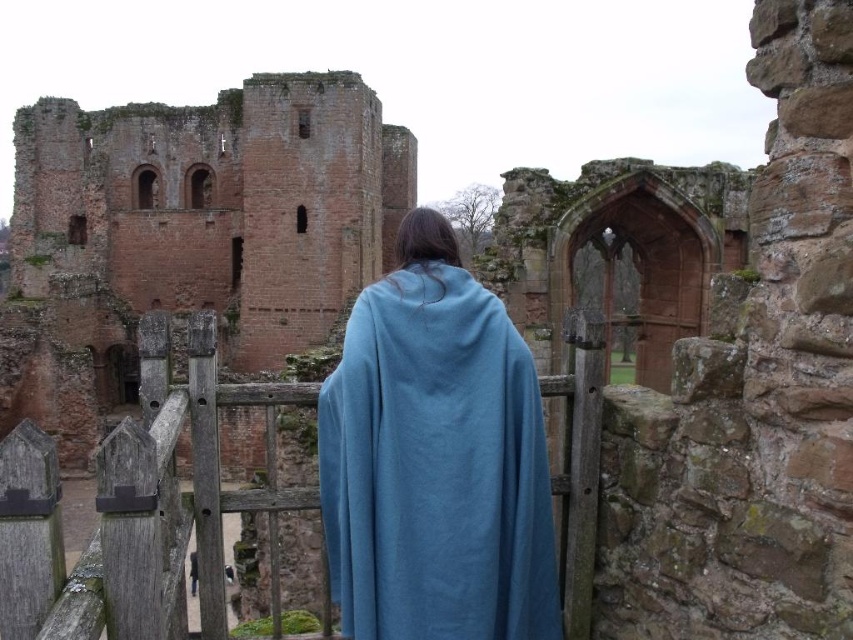
You are standing at a certain distance from the blue woolen cloak at center. If you want to reach it within 10 seconds, what is the minimum speed you need to move at?

The blue woolen cloak at center is 28.63 meters away. To reach it in 10 seconds, you would need to move at a minimum speed of 2.863 meters per second.

You are an observer standing at the edge of the stone structure. You see the blue woolen cloak at center and the wooden at center. Which object is positioned to the left?

The wooden at center is positioned to the left of the blue woolen cloak at center.